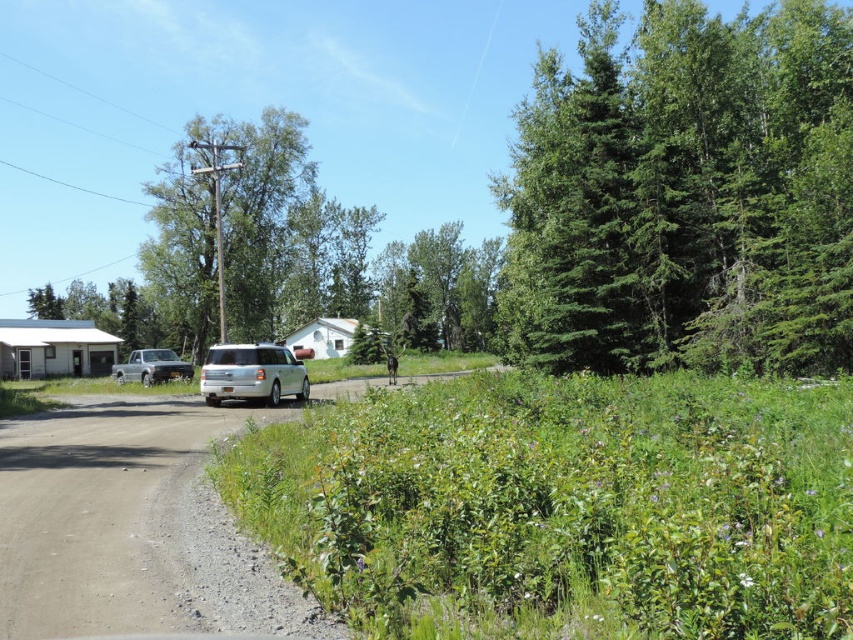
Based on the photo, you are a delivery driver who needs to park a new vehicle between the white matte suv at center and the silver metallic truck at left. Can you fit a vehicle that is 2 meters wide in this space?

The white matte suv at center is thinner than the silver metallic truck at left, but without knowing the exact width of the space between them, it is impossible to determine if a 2 meter wide vehicle can fit.

You are a hiker standing on the dirt road and want to take a photo of both the green leafy shrubs at center and the silver metallic truck at left. Which object should you focus on first to ensure both are in the frame?

You should focus on the green leafy shrubs at center first because it is closer to you than the silver metallic truck at left, allowing both to be in the frame when properly adjusted.